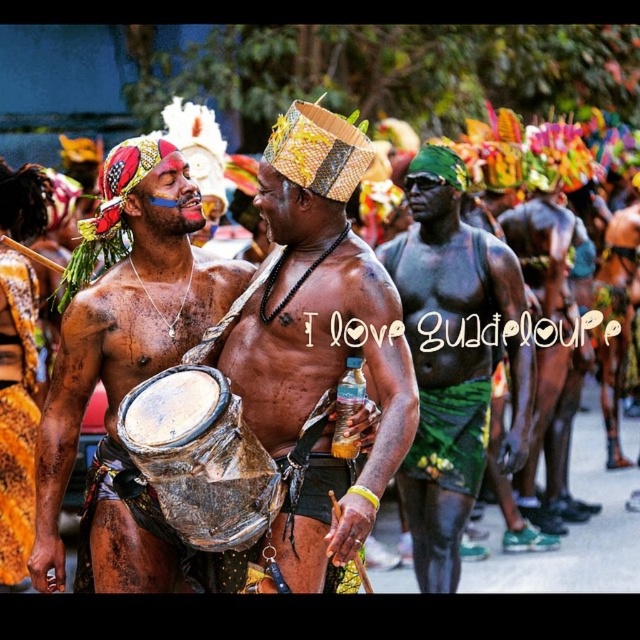
Question: From the image, what is the correct spatial relationship of shiny metallic drum at center in relation to green textured fabric at center?

Choices:
 (A) above
 (B) below

Answer: (B)

Question: Can you confirm if shiny metallic drum at center is positioned to the right of rusty metallic drum at center?

Choices:
 (A) no
 (B) yes

Answer: (B)

Question: Which of these objects is positioned farthest from the rusty metallic drum at center?

Choices:
 (A) shiny metallic drum at center
 (B) green woven cloth at center
 (C) green textured fabric at center

Answer: (C)

Question: Which object is farther from the camera taking this photo?

Choices:
 (A) rusty metallic drum at center
 (B) green textured fabric at center
 (C) green woven cloth at center

Answer: (C)

Question: Does shiny metallic drum at center have a smaller size compared to green woven cloth at center?

Choices:
 (A) no
 (B) yes

Answer: (B)

Question: Which object is closer to the camera taking this photo?

Choices:
 (A) green textured fabric at center
 (B) shiny metallic drum at center

Answer: (B)